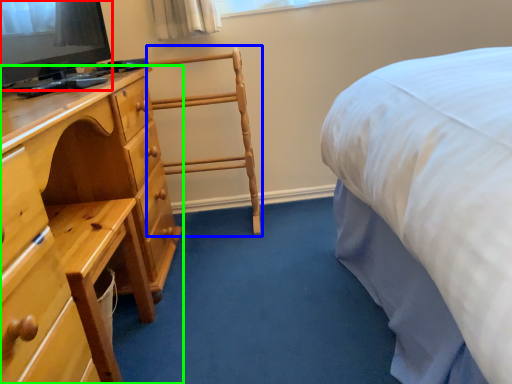
Question: Which object is the farthest from television (highlighted by a red box)? Choose among these: chair (highlighted by a blue box) or chest of drawers (highlighted by a green box).

Choices:
 (A) chair
 (B) chest of drawers

Answer: (A)